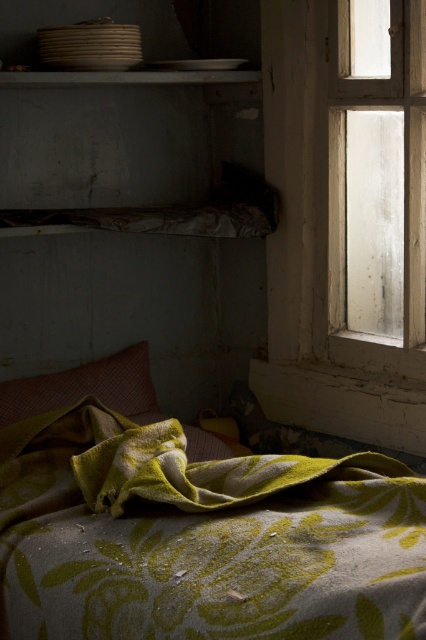
Question: Which object appears farthest from the camera in this image?

Choices:
 (A) wooden frame window at right
 (B) smooth white shelf at upper center

Answer: (B)

Question: Which object is positioned farthest from the red plaid pillow at center?

Choices:
 (A) floral-patterned fabric at lower center
 (B) smooth white shelf at upper center

Answer: (B)

Question: Which object appears farthest from the camera in this image?

Choices:
 (A) floral-patterned fabric at lower center
 (B) red plaid pillow at center

Answer: (B)

Question: Does red plaid pillow at center appear over smooth white shelf at upper center?

Choices:
 (A) yes
 (B) no

Answer: (B)

Question: Is wooden frame window at right smaller than smooth white shelf at upper center?

Choices:
 (A) yes
 (B) no

Answer: (B)

Question: Can you confirm if red plaid pillow at center is bigger than smooth white shelf at upper center?

Choices:
 (A) yes
 (B) no

Answer: (A)